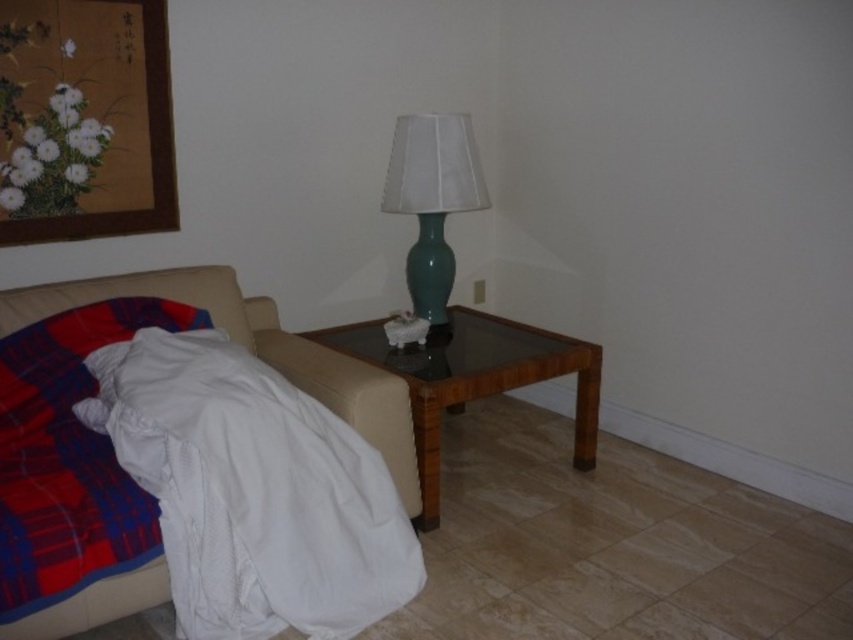
You are arranging a small party in the room and need to place a decorative vase. The vase is 10 cm tall. You want to place it on the woodenside table at center but need to ensure there is enough space. Is the white textured blanket at lower left in the way?

The white textured blanket at lower left is positioned under the woodenside table at center, so it won not obstruct the placement of the vase on the table. The vase can be safely placed on the woodenside table at center.

You are organizing a small gathering in the room and need to place a tray of snacks on the surface. Which object between the white textured blanket at lower left and the woodenside table at center is more suitable for placing the snacks?

The woodenside table at center is more suitable for placing the snacks because the white textured blanket at lower left is positioned on the left side of the woodenside table at center, meaning the table is a stable surface while the blanket is likely part of seating.